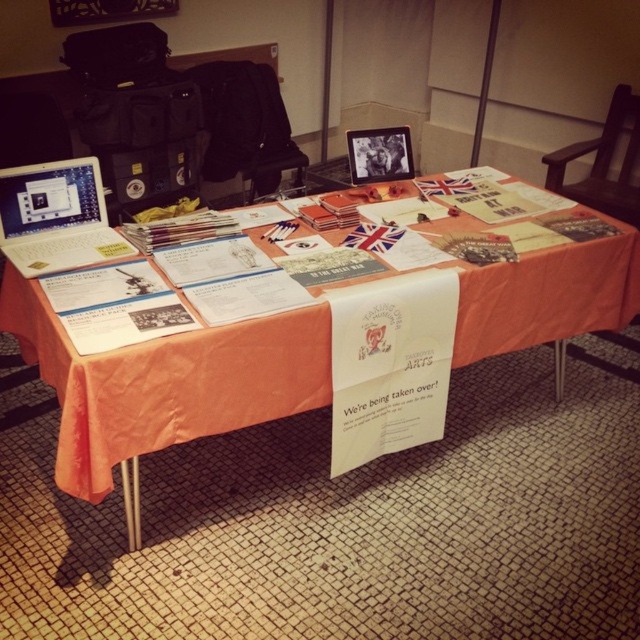
You are organizing an event and need to place a new decorative item on the table. The orange fabric tablecloth at center and the matte black tablet at upper center are already there. Where should you place the new item so it doesn not block the tablet?

Place the new item on the orange fabric tablecloth at center, as it is positioned under the matte black tablet at upper center, leaving space above it for the new item without blocking the tablet.

In the scene shown: You are standing at the front of the table and want to reach both the point at (528, 301) and the point at (115, 237). Which point is closer to you?

The point at (115, 237) is closer to you because it is in front of the point at (528, 301).

You are organizing a presentation and need to place a 10 inch wide decorative item between the orange fabric tablecloth at center and the silver metallic laptop at left. Can you fit it there?

The distance between the orange fabric tablecloth at center and the silver metallic laptop at left is 9.46 inches, so the 10 inch wide decorative item cannot fit in that space.